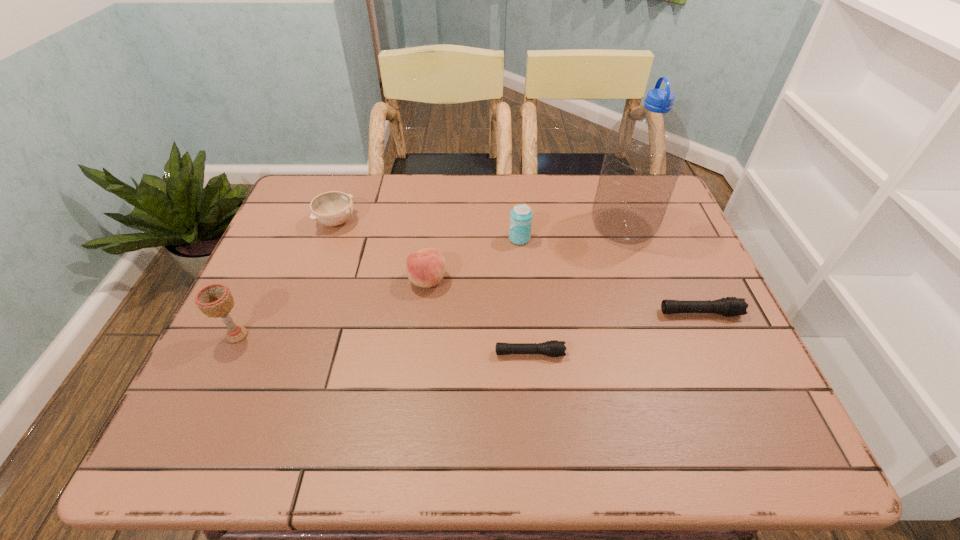
Where is `free space between the farther flashlight and the water jug`? Image resolution: width=960 pixels, height=540 pixels. free space between the farther flashlight and the water jug is located at coordinates (661, 270).

This screenshot has width=960, height=540. Identify the location of unoccupied position between the water jug and the bowl. (480, 225).

Where is `unoccupied area between the second object from left to right and the peach`? The width and height of the screenshot is (960, 540). unoccupied area between the second object from left to right and the peach is located at coordinates (382, 251).

Where is `the sixth closest object relative to the peach`? This screenshot has height=540, width=960. the sixth closest object relative to the peach is located at coordinates (731, 306).

Locate an element on the screen. object that can be found as the fourth closest to the fifth tallest object is located at coordinates (555, 348).

At what (x,y) coordinates should I click in order to perform the action: click on free space in the image that satisfies the following two spatial constraints: 1. on the front side of the water jug; 2. on the right side of the sixth object from right to left. Please return your answer as a coordinate pair (x, y). The image size is (960, 540). Looking at the image, I should click on (334, 227).

In order to click on free location that satisfies the following two spatial constraints: 1. at the lens end of the farther flashlight; 2. on the front side of the chalice in this screenshot , I will do `click(710, 335)`.

Find the location of `vacant position in the image that satisfies the following two spatial constraints: 1. on the back side of the fourth farthest object; 2. on the left side of the chalice`. vacant position in the image that satisfies the following two spatial constraints: 1. on the back side of the fourth farthest object; 2. on the left side of the chalice is located at coordinates (263, 280).